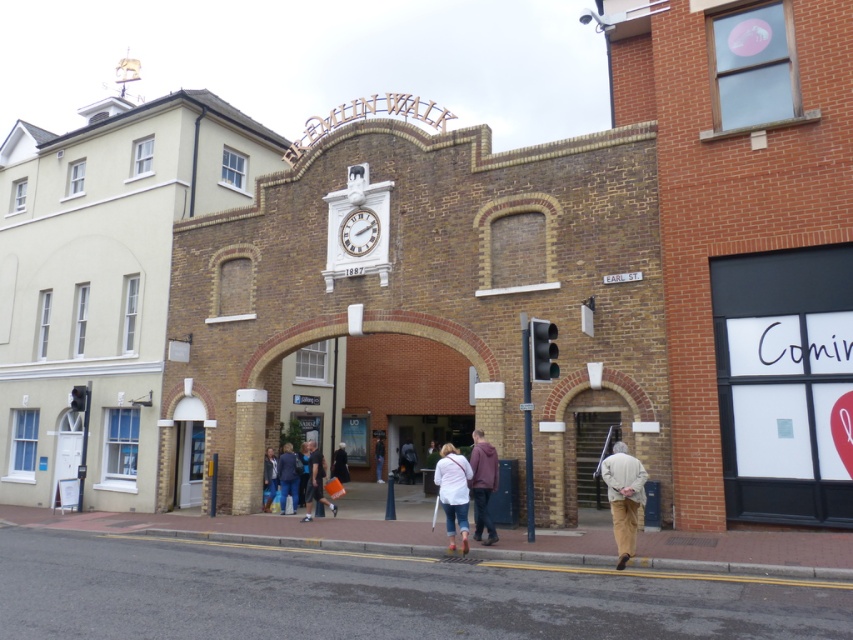
Between white matte jacket at center and denim jacket at center, which one is positioned lower?

denim jacket at center is lower down.

Is white matte jacket at center bigger than denim jacket at center?

No.

You are a GUI agent. You are given a task and a screenshot of the screen. Output one action in this format:
    pyautogui.click(x=<x>, y=<y>)
    Task: Click on the white matte jacket at center
    This screenshot has height=640, width=853.
    Given the screenshot: What is the action you would take?
    pyautogui.click(x=453, y=492)

Locate an element on the screen. white matte jacket at center is located at coordinates (x=453, y=492).

Does white glossy clock at center have a larger size compared to denim jacket at center?

No, white glossy clock at center is not bigger than denim jacket at center.

Which is below, white glossy clock at center or denim jacket at center?

Positioned lower is denim jacket at center.

Does point (354, 236) come closer to viewer compared to point (288, 445)?

Yes, it is.

Identify the location of white glossy clock at center. Image resolution: width=853 pixels, height=640 pixels. (358, 230).

This screenshot has width=853, height=640. Describe the element at coordinates (482, 484) in the screenshot. I see `maroon fabric jacket at center` at that location.

Who is more forward, (492, 460) or (294, 496)?

Point (492, 460) is in front.

At what (x,y) coordinates should I click in order to perform the action: click on maroon fabric jacket at center. Please return your answer as a coordinate pair (x, y). This screenshot has height=640, width=853. Looking at the image, I should click on (482, 484).